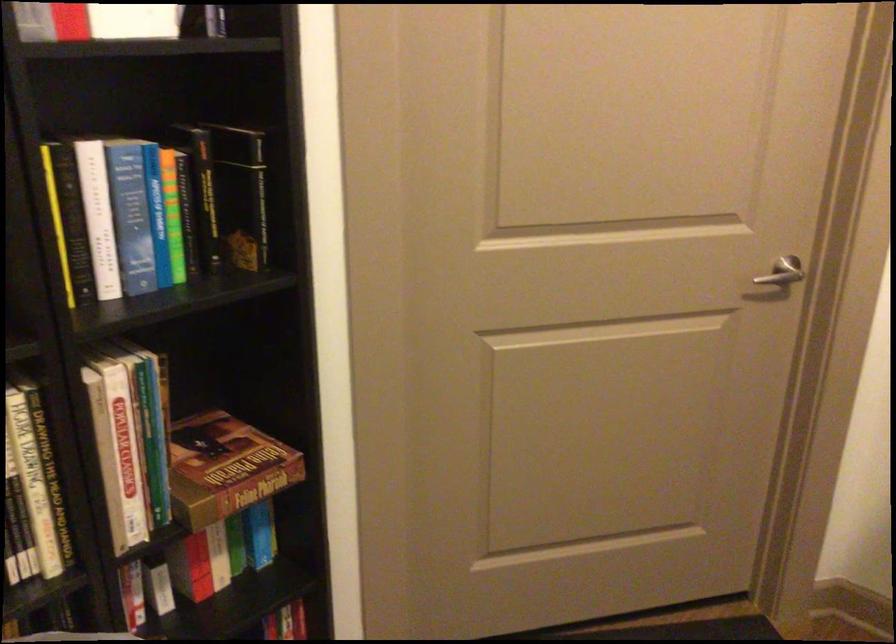
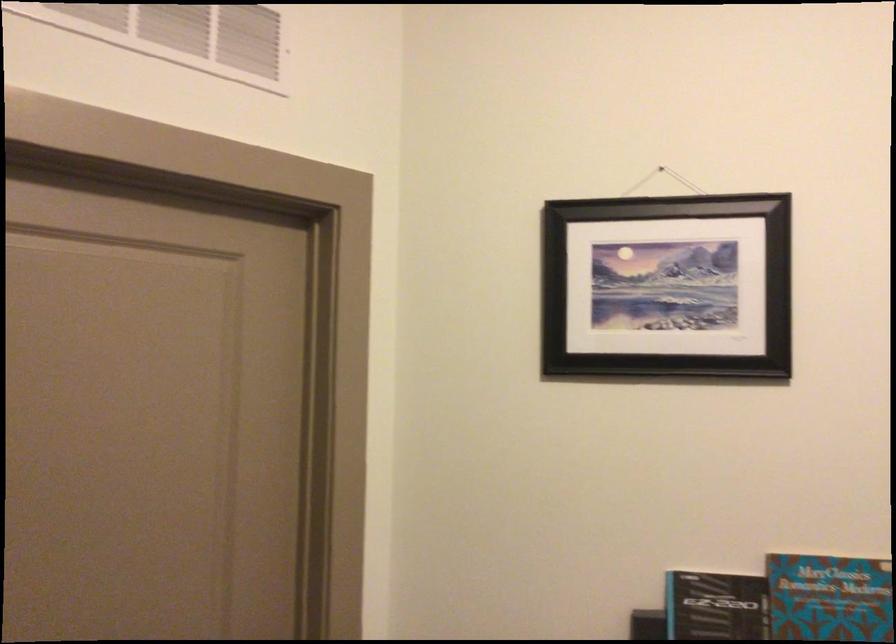
The images are taken continuously from a first-person perspective. In which direction is your viewpoint rotating?

The camera rotated toward right-up.